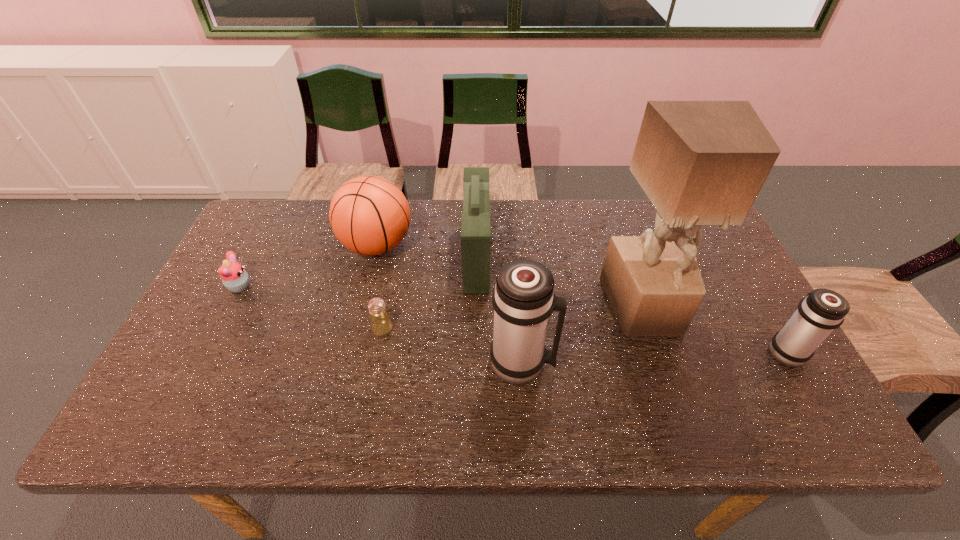
Locate an element on the screen. the taller thermos bottle is located at coordinates (523, 299).

This screenshot has width=960, height=540. I want to click on the second tallest object, so click(x=523, y=299).

This screenshot has width=960, height=540. Find the location of `the rightmost object`. the rightmost object is located at coordinates (821, 311).

Where is `the shorter thermos bottle`? the shorter thermos bottle is located at coordinates pos(821,311).

Identify the location of basketball. (369, 215).

Where is `the leftmost object`? This screenshot has width=960, height=540. the leftmost object is located at coordinates (234, 277).

You are a GUI agent. You are given a task and a screenshot of the screen. Output one action in this format:
    pyautogui.click(x=<x>, y=<y>)
    Task: Click on the first-aid kit
    The height and width of the screenshot is (540, 960).
    Given the screenshot: What is the action you would take?
    pyautogui.click(x=475, y=221)

At what (x,y) coordinates should I click in order to perform the action: click on the tallest object. Please return your answer as a coordinate pair (x, y). This screenshot has width=960, height=540. Looking at the image, I should click on (700, 163).

Find the location of a particular element. The height and width of the screenshot is (540, 960). sculpture is located at coordinates [x=700, y=163].

The image size is (960, 540). Identify the location of saltshaker. (381, 324).